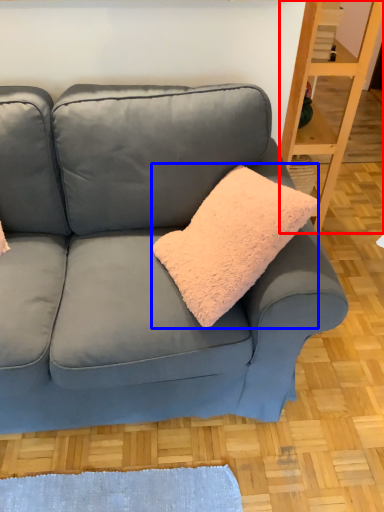
Question: Which object is further to the camera taking this photo, shelf (highlighted by a red box) or throw pillow (highlighted by a blue box)?

Choices:
 (A) shelf
 (B) throw pillow

Answer: (A)